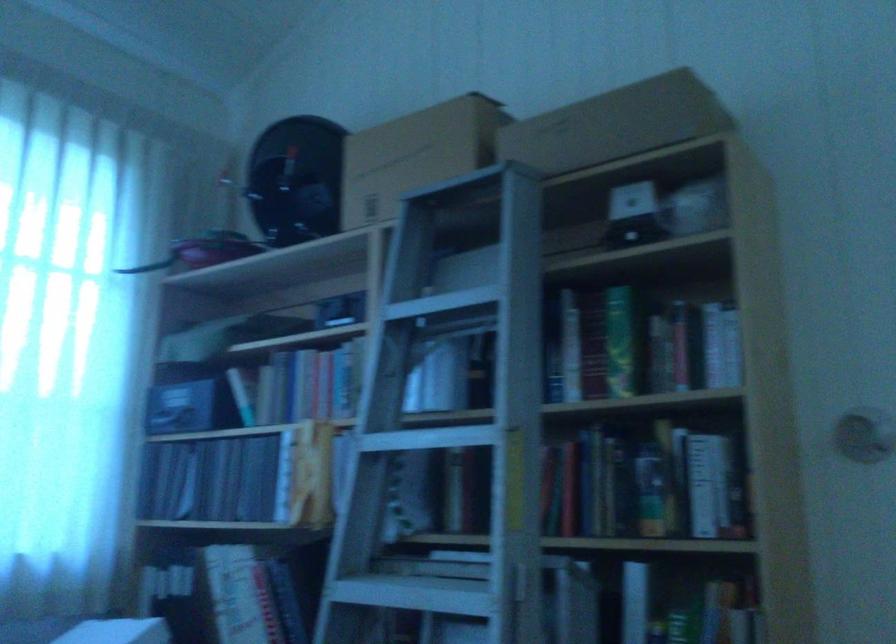
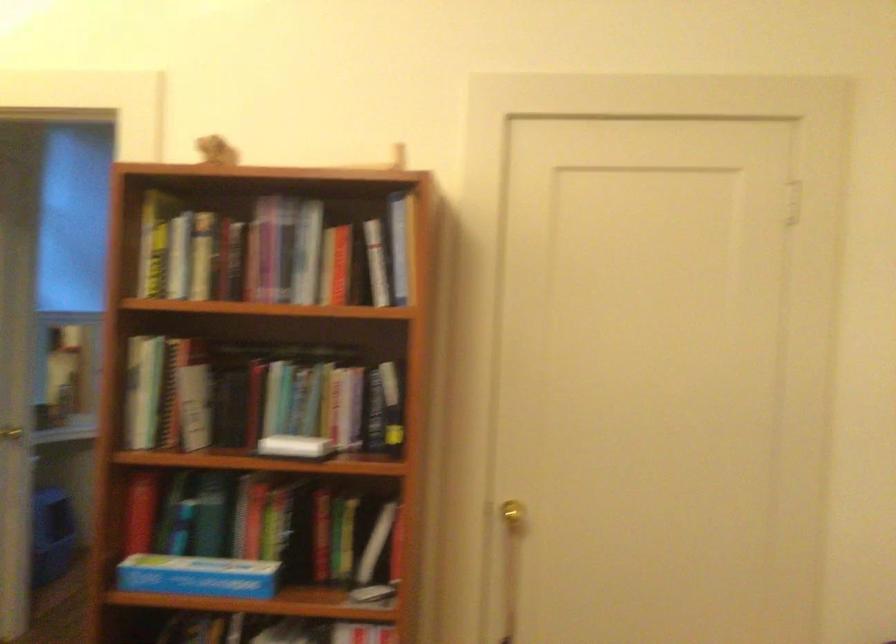
Question: I am providing you with two images of the same scene from different viewpoints. Which of the following objects are not visible in image2?

Choices:
 (A) book
 (B) brown leather gloves
 (C) silver door knob
 (D) small brown figurine

Answer: (A)